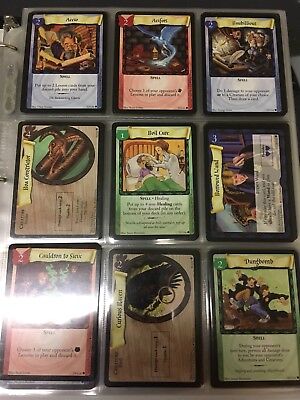
At what (x,y) coordinates should I click in order to perform the action: click on playing cards. Please return your answer as a coordinate pair (x, y). Image resolution: width=300 pixels, height=400 pixels. Looking at the image, I should click on (68, 69), (144, 76), (236, 85), (227, 166), (150, 166), (63, 168), (70, 299), (135, 304), (249, 321).